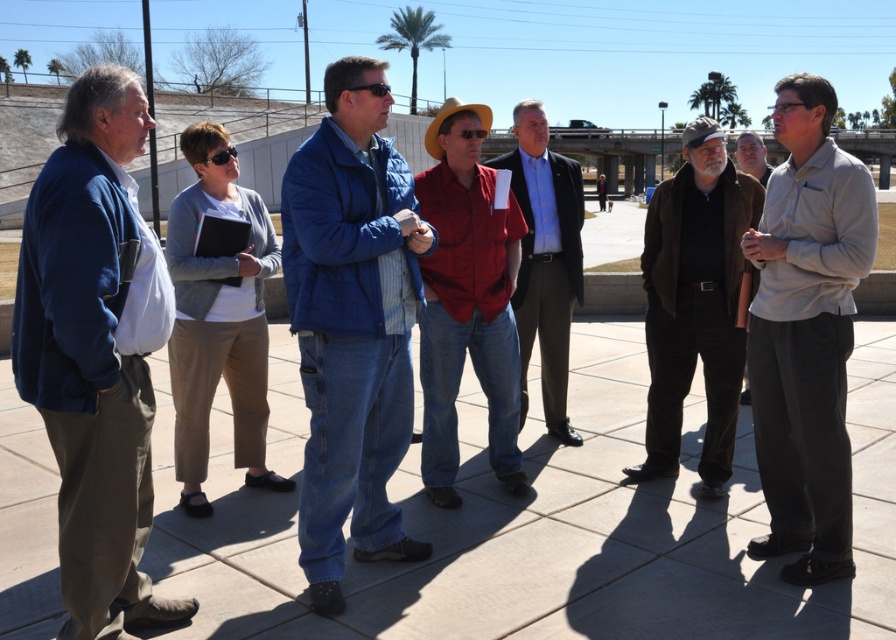
Question: Which point appears closest to the camera in this image?

Choices:
 (A) (797, 332)
 (B) (751, 152)
 (C) (304, 225)
 (D) (462, 109)

Answer: (C)

Question: Based on their relative distances, which object is farther from the brown leather jacket at center?

Choices:
 (A) dark brown leather jacket at center
 (B) red shirt at center
 (C) blue quilted jacket at center
 (D) gray cotton shirt at center

Answer: (D)

Question: Estimate the real-world distances between objects in this image. Which object is closer to the red shirt at center?

Choices:
 (A) brown leather jacket at center
 (B) matte blue jacket at left
 (C) red denim jeans at center

Answer: (C)

Question: Observing the image, what is the correct spatial positioning of blue quilted jacket at center in reference to brown leather jacket at center?

Choices:
 (A) below
 (B) above

Answer: (A)

Question: Does dark brown leather jacket at center have a greater width compared to brown leather jacket at center?

Choices:
 (A) no
 (B) yes

Answer: (A)

Question: Observing the image, what is the correct spatial positioning of blue quilted jacket at center in reference to red shirt at center?

Choices:
 (A) below
 (B) above

Answer: (A)